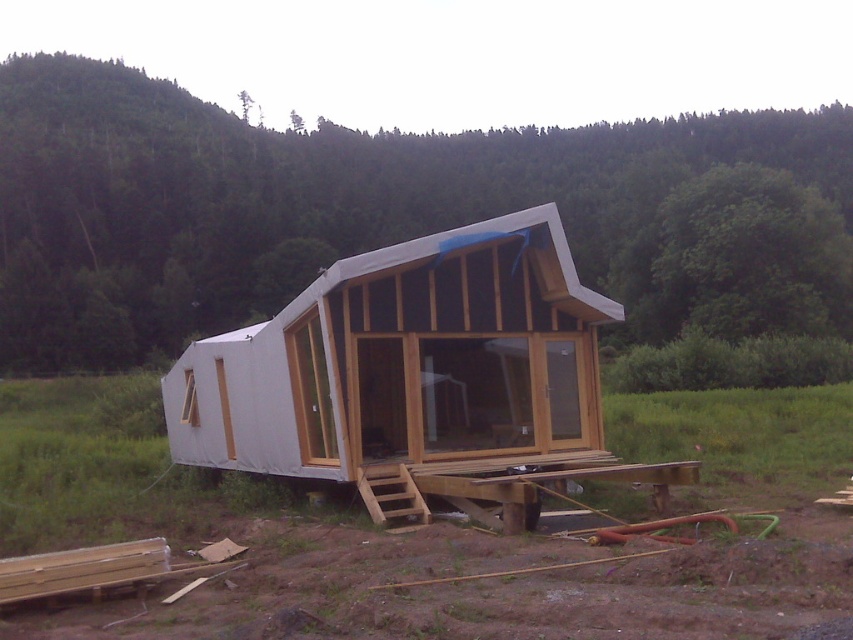
Question: Can you confirm if white matte cabin at center is positioned above clear glass door at center?

Choices:
 (A) no
 (B) yes

Answer: (A)

Question: Which object is the farthest from the white matte cabin at center?

Choices:
 (A) clear glass door at center
 (B) white wood cabin at center

Answer: (B)

Question: Does white wood cabin at center appear on the right side of clear glass door at center?

Choices:
 (A) no
 (B) yes

Answer: (A)

Question: Among these objects, which one is farthest from the camera?

Choices:
 (A) white wood cabin at center
 (B) clear glass door at center
 (C) white matte cabin at center

Answer: (A)

Question: Is white wood cabin at center in front of white matte cabin at center?

Choices:
 (A) no
 (B) yes

Answer: (A)

Question: Which point is closer to the camera?

Choices:
 (A) transparent glass door at center
 (B) clear glass door at center
 (C) transparent glass window at center

Answer: (B)